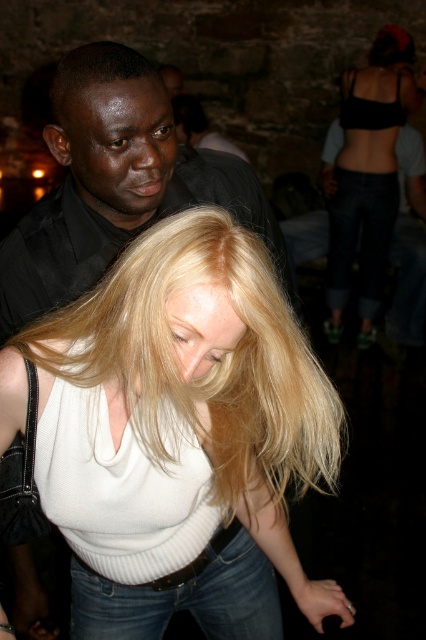
What do you see at coordinates (368, 173) in the screenshot? The width and height of the screenshot is (426, 640). I see `black matte tank top at upper right` at bounding box center [368, 173].

Between black matte tank top at upper right and shiny black hair at upper left, which one appears on the right side from the viewer's perspective?

black matte tank top at upper right is more to the right.

Which is in front, point (353, 116) or point (109, 77)?

Point (109, 77) is more forward.

The width and height of the screenshot is (426, 640). I want to click on black matte tank top at upper right, so click(x=368, y=173).

Who is lower down, white knitwear at center or shiny black hair at upper left?

Positioned lower is white knitwear at center.

Can you confirm if white knitwear at center is bigger than shiny black hair at upper left?

Correct, white knitwear at center is larger in size than shiny black hair at upper left.

Is point (331, 468) less distant than point (109, 77)?

No, it is not.

Where is `white knitwear at center`? white knitwear at center is located at coordinates (178, 435).

Does white knitwear at center have a greater width compared to denim jeans at lower center?

Yes.

The width and height of the screenshot is (426, 640). I want to click on white knitwear at center, so click(178, 435).